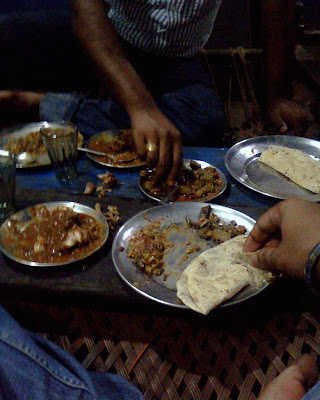
You are a GUI agent. You are given a task and a screenshot of the screen. Output one action in this format:
    pyautogui.click(x=<x>, y=<y>)
    Task: Click on the cord
    
    Given the screenshot: What is the action you would take?
    pyautogui.click(x=134, y=360)